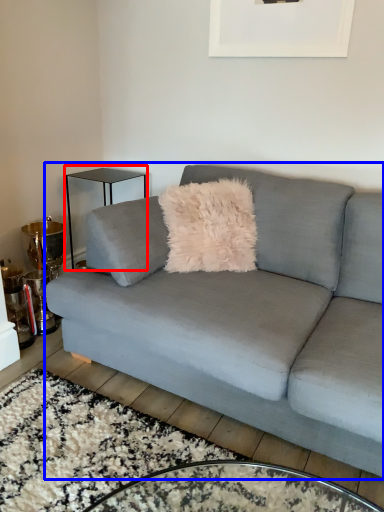
Question: Among these objects, which one is farthest to the camera, table (highlighted by a red box) or studio couch (highlighted by a blue box)?

Choices:
 (A) table
 (B) studio couch

Answer: (A)